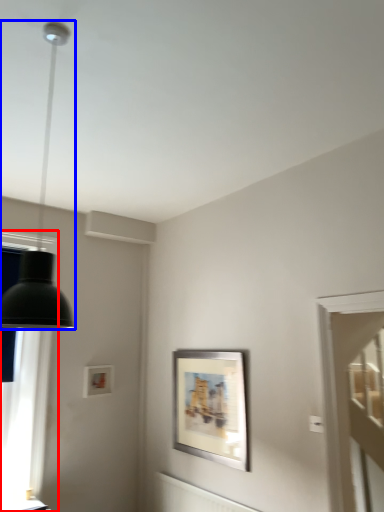
Question: Among these objects, which one is nearest to the camera, window (highlighted by a red box) or lamp (highlighted by a blue box)?

Choices:
 (A) window
 (B) lamp

Answer: (B)